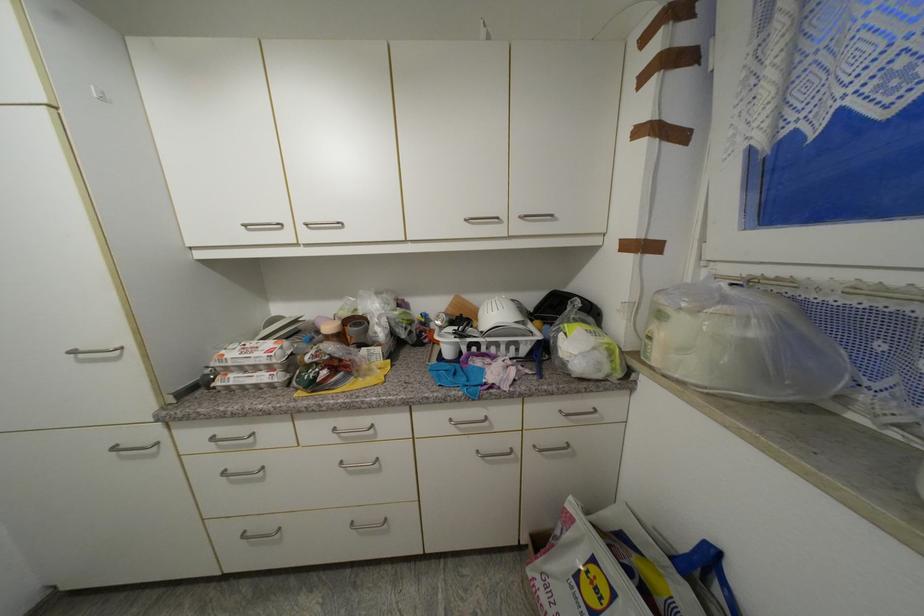
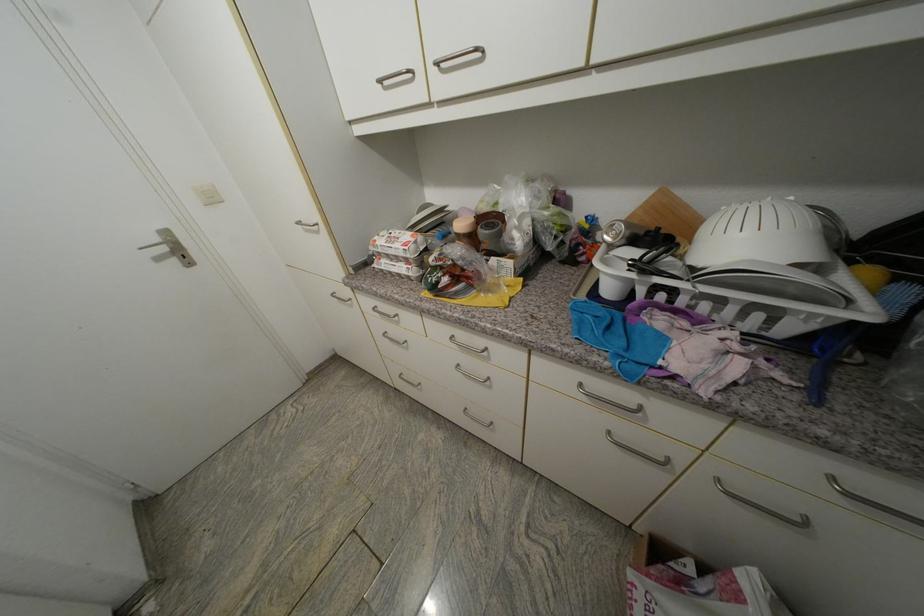
How did the camera likely rotate?

The rotation direction of the camera is left-down.